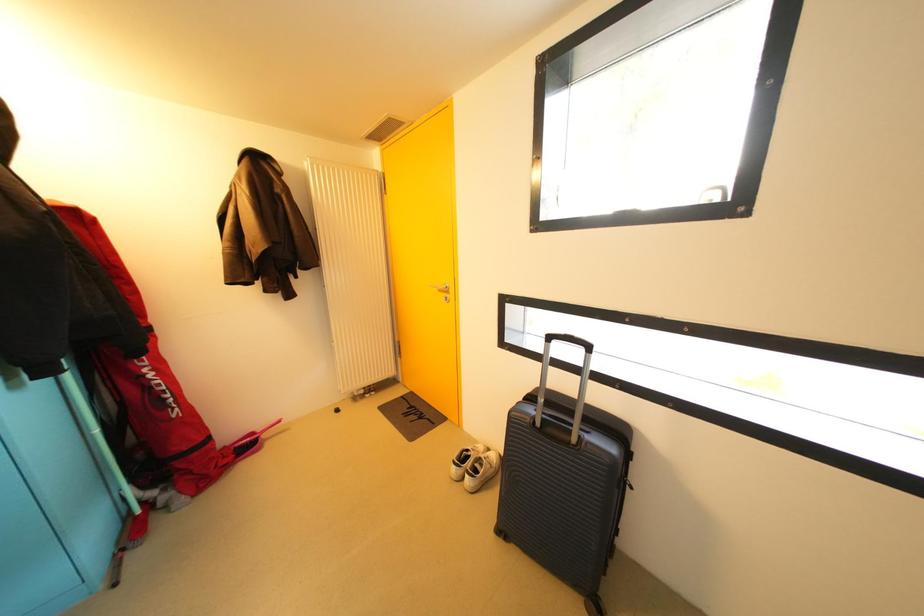
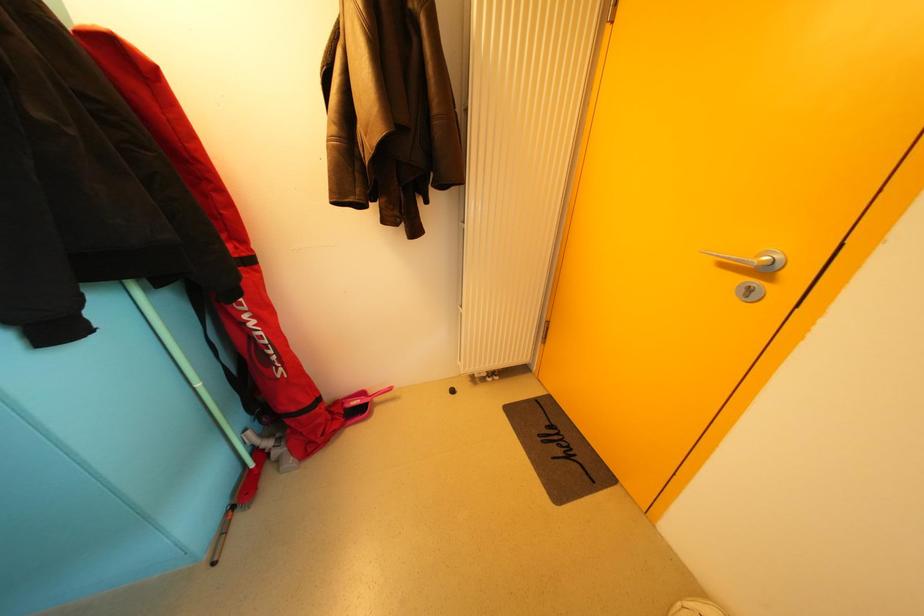
In a continuous first-person perspective shot, in which direction is the camera moving?

The cameraman moved toward left, forward.